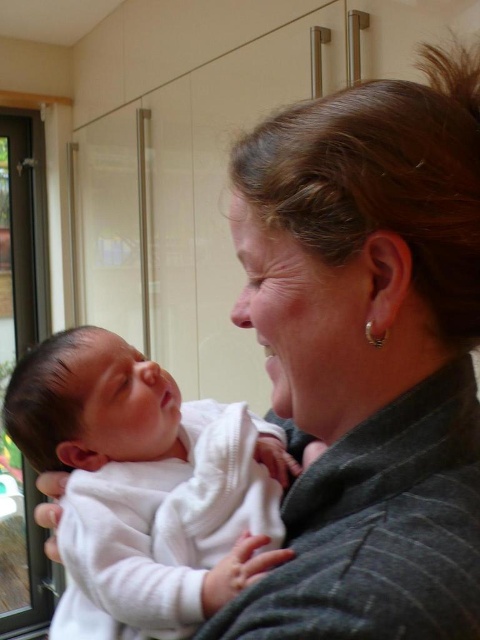
You are a delivery person at the entrance of the house. You see the white soft baby at center and the transparent glass screen door at left. Which object is closer to you?

The transparent glass screen door at left is closer to you because the white soft baby at center is to the right of it, meaning the baby is further away from your position at the entrance.

You are a delivery person who needs to hand over a package to the adult holding the white soft baby at center. The transparent glass screen door at left is closed. Can you reach the adult without opening the door?

The white soft baby at center occupies less space than the transparent glass screen door at left, so the adult holding the baby can likely reach through the door to take the package without opening it.

You are a delivery person holding a package and standing outside the transparent glass screen door at left. You need to hand the package to the adult holding the white soft baby at center. Can you reach them without entering the house?

The white soft baby at center is 7.52 feet away from the transparent glass screen door at left. Since the distance is more than arm length, you cannot reach them without entering the house.